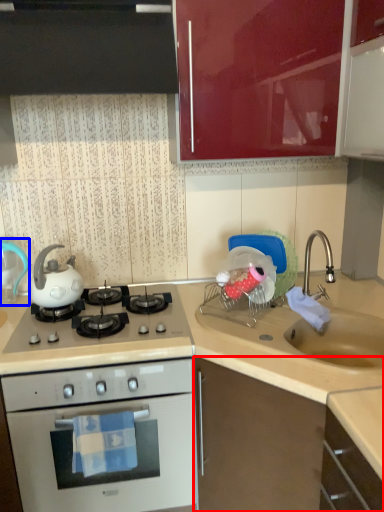
Question: Which object appears farthest to the camera in this image, cabinetry (highlighted by a red box) or kitchen appliance (highlighted by a blue box)?

Choices:
 (A) cabinetry
 (B) kitchen appliance

Answer: (B)